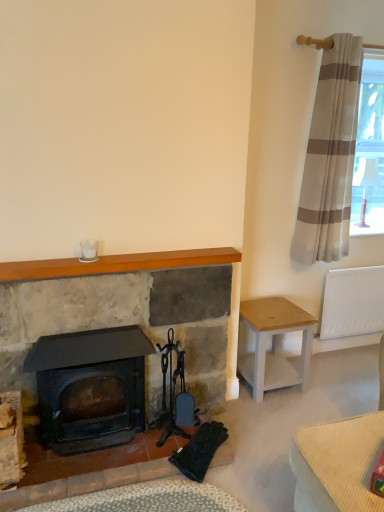
Where is `free space to the right of white wood stool at right`? free space to the right of white wood stool at right is located at coordinates (330, 388).